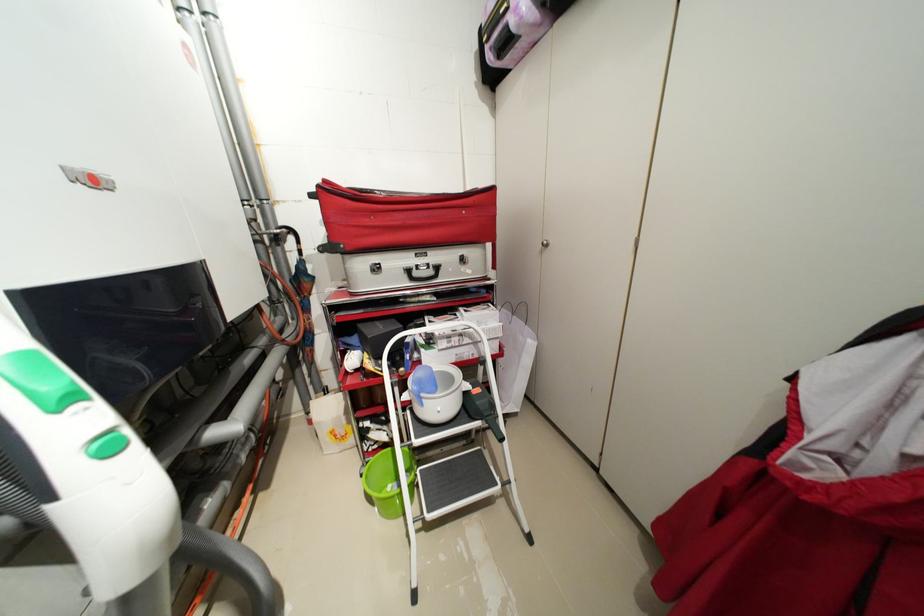
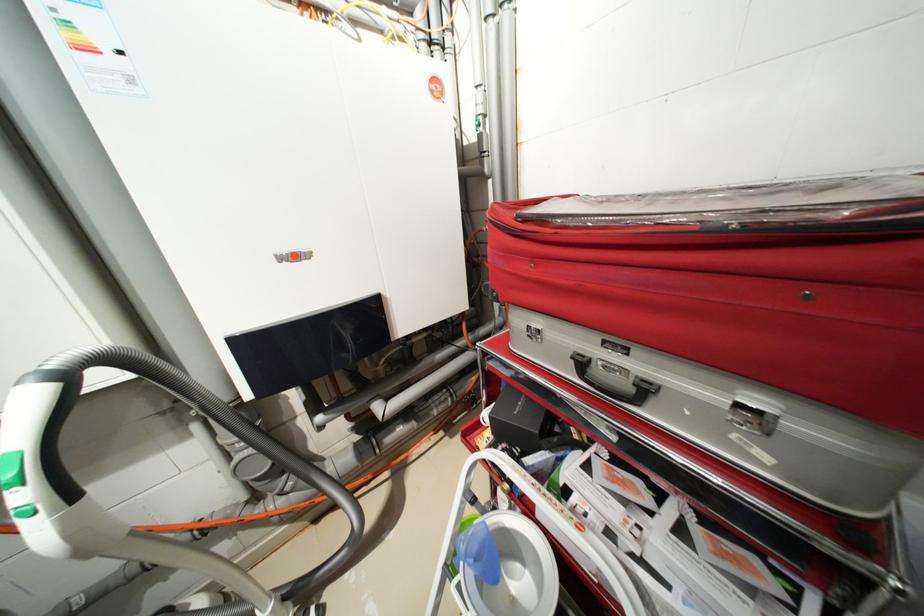
Find the pixel in the second image that matches (416,272) in the first image.

(589, 363)